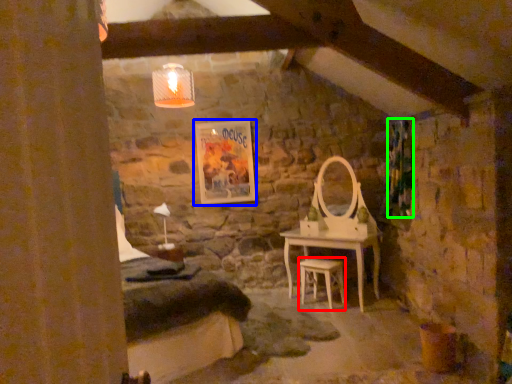
Question: Estimate the real-world distances between objects in this image. Which object is farther from stool (highlighted by a red box), picture frame (highlighted by a blue box) or curtain (highlighted by a green box)?

Choices:
 (A) picture frame
 (B) curtain

Answer: (A)